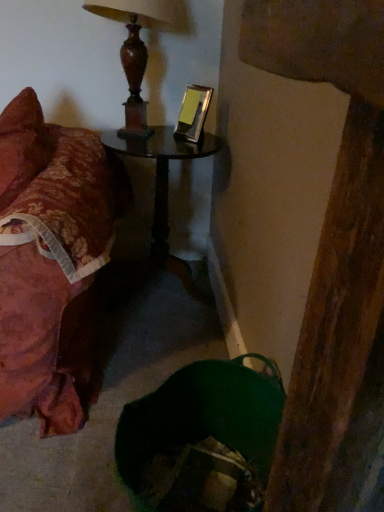
Describe the element at coordinates (137, 48) in the screenshot. Image resolution: width=384 pixels, height=512 pixels. I see `wooden lamp at upper center` at that location.

What do you see at coordinates (50, 259) in the screenshot? I see `floral fabric bed at left` at bounding box center [50, 259].

Measure the distance between black glass table at center and camera.

A distance of 1.65 meters exists between black glass table at center and camera.

In order to click on wooden lamp at upper center in this screenshot , I will do `click(137, 48)`.

Would you say black glass table at center contains floral fabric bed at left?

No, black glass table at center does not contain floral fabric bed at left.

From the image's perspective, which is above, black glass table at center or floral fabric bed at left?

black glass table at center is shown above in the image.

Is black glass table at center oriented towards floral fabric bed at left?

Answer: No, black glass table at center does not turn towards floral fabric bed at left.

Find the location of `furniture on the left of black glass table at center`. furniture on the left of black glass table at center is located at coordinates (50, 259).

Considering the relative positions of wooden lamp at upper center and floral fabric bed at left in the image provided, is wooden lamp at upper center to the left of floral fabric bed at left from the viewer's perspective?

No.

How many degrees apart are the facing directions of wooden lamp at upper center and floral fabric bed at left?

There is a 0.000416-degree angle between the facing directions of wooden lamp at upper center and floral fabric bed at left.

Does wooden lamp at upper center have a larger size compared to floral fabric bed at left?

No, wooden lamp at upper center is not bigger than floral fabric bed at left.

Is floral fabric bed at left bigger or smaller than wooden lamp at upper center?

Clearly, floral fabric bed at left is larger in size than wooden lamp at upper center.

Can you tell me how much floral fabric bed at left and wooden lamp at upper center differ in facing direction?

0.000416 degrees separate the facing orientations of floral fabric bed at left and wooden lamp at upper center.

How much distance is there between floral fabric bed at left and wooden lamp at upper center?

floral fabric bed at left is 53.21 centimeters away from wooden lamp at upper center.

Is floral fabric bed at left positioned before wooden lamp at upper center?

Yes, floral fabric bed at left is closer to the viewer.

Is wooden lamp at upper center oriented towards black glass table at center?

No, wooden lamp at upper center is not oriented towards black glass table at center.

Considering the positions of objects wooden lamp at upper center and black glass table at center in the image provided, who is more to the right, wooden lamp at upper center or black glass table at center?

black glass table at center is more to the right.

In terms of height, does wooden lamp at upper center look taller or shorter compared to black glass table at center?

Clearly, wooden lamp at upper center is shorter compared to black glass table at center.

From the image's perspective, relative to wooden lamp at upper center, is black glass table at center above or below?

black glass table at center is below wooden lamp at upper center.

Is black glass table at center not near wooden lamp at upper center?

No, there isn't a large distance between black glass table at center and wooden lamp at upper center.

Does black glass table at center turn towards wooden lamp at upper center?

No, black glass table at center is not aimed at wooden lamp at upper center.

How many degrees apart are the facing directions of black glass table at center and wooden lamp at upper center?

The angle between the facing direction of black glass table at center and the facing direction of wooden lamp at upper center is 0.000327 degrees.

Is floral fabric bed at left inside or outside of black glass table at center?

floral fabric bed at left lies outside black glass table at center.

Could you tell me if floral fabric bed at left is facing black glass table at center?

No, floral fabric bed at left is not oriented towards black glass table at center.

How much distance is there between floral fabric bed at left and black glass table at center?

The distance of floral fabric bed at left from black glass table at center is 18.86 inches.

At what (x,y) coordinates should I click in order to perform the action: click on table directly beneath the floral fabric bed at left (from a real-world perspective). Please return your answer as a coordinate pair (x, y). This screenshot has width=384, height=512. Looking at the image, I should click on (165, 191).

Locate an element on the screen. This screenshot has width=384, height=512. lamp that is above the floral fabric bed at left (from the image's perspective) is located at coordinates (137, 48).

Looking at the image, which one is located closer to wooden lamp at upper center, black glass table at center or floral fabric bed at left?

black glass table at center.

Looking at the image, which one is located further to black glass table at center, wooden lamp at upper center or floral fabric bed at left?

floral fabric bed at left lies further to black glass table at center than the other object.

Estimate the real-world distances between objects in this image. Which object is closer to floral fabric bed at left, black glass table at center or wooden lamp at upper center?

black glass table at center.

When comparing their distances from floral fabric bed at left, does wooden lamp at upper center or black glass table at center seem closer?

black glass table at center lies closer to floral fabric bed at left than the other object.

Which object lies nearer to the anchor point black glass table at center, floral fabric bed at left or wooden lamp at upper center?

wooden lamp at upper center lies closer to black glass table at center than the other object.

Looking at the image, which one is located further to wooden lamp at upper center, floral fabric bed at left or black glass table at center?

floral fabric bed at left is positioned further to the anchor wooden lamp at upper center.

Find the location of a particular element. The height and width of the screenshot is (512, 384). lamp between floral fabric bed at left and black glass table at center from front to back is located at coordinates (137, 48).